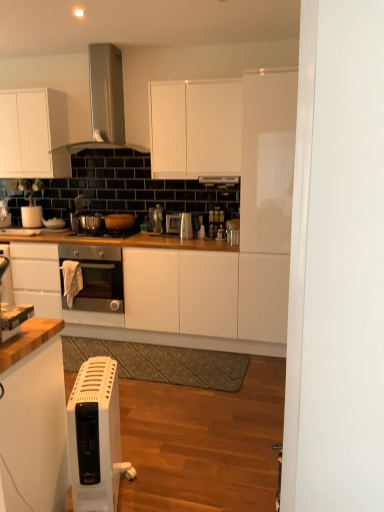
Question: Is shiny metallic gas stove at center positioned beyond the bounds of satin black oven at center?

Choices:
 (A) no
 (B) yes

Answer: (B)

Question: From a real-world perspective, is shiny metallic gas stove at center beneath satin black oven at center?

Choices:
 (A) no
 (B) yes

Answer: (A)

Question: Is shiny metallic gas stove at center bigger than satin black oven at center?

Choices:
 (A) no
 (B) yes

Answer: (A)

Question: From a real-world perspective, is shiny metallic gas stove at center physically above satin black oven at center?

Choices:
 (A) yes
 (B) no

Answer: (A)

Question: From the image's perspective, is shiny metallic gas stove at center on satin black oven at center?

Choices:
 (A) yes
 (B) no

Answer: (A)

Question: Considering the relative positions of shiny metallic gas stove at center and satin black oven at center in the image provided, is shiny metallic gas stove at center in front of satin black oven at center?

Choices:
 (A) no
 (B) yes

Answer: (A)

Question: Considering the relative positions of satin silver kettle at center, placed as the sixth appliance when sorted from left to right, and white plastic heater at lower left in the image provided, is satin silver kettle at center, placed as the sixth appliance when sorted from left to right, behind white plastic heater at lower left?

Choices:
 (A) yes
 (B) no

Answer: (A)

Question: Can you confirm if satin silver kettle at center, which is counted as the 2th appliance, starting from the right, is thinner than white plastic heater at lower left?

Choices:
 (A) yes
 (B) no

Answer: (A)

Question: Is there a large distance between satin silver kettle at center, placed as the sixth appliance when sorted from left to right, and white plastic heater at lower left?

Choices:
 (A) no
 (B) yes

Answer: (B)

Question: Is satin silver kettle at center, the third appliance when ordered from front to back, at the right side of white plastic heater at lower left?

Choices:
 (A) yes
 (B) no

Answer: (A)

Question: Does satin silver kettle at center, placed as the sixth appliance when sorted from left to right, contain white plastic heater at lower left?

Choices:
 (A) yes
 (B) no

Answer: (B)

Question: Could you tell me if satin silver kettle at center, which is counted as the 2th appliance, starting from the right, is turned towards white plastic heater at lower left?

Choices:
 (A) no
 (B) yes

Answer: (A)

Question: Is satin silver toaster at center, placed as the 3th appliance when sorted from back to front, closer to camera compared to satin black oven at center?

Choices:
 (A) yes
 (B) no

Answer: (B)